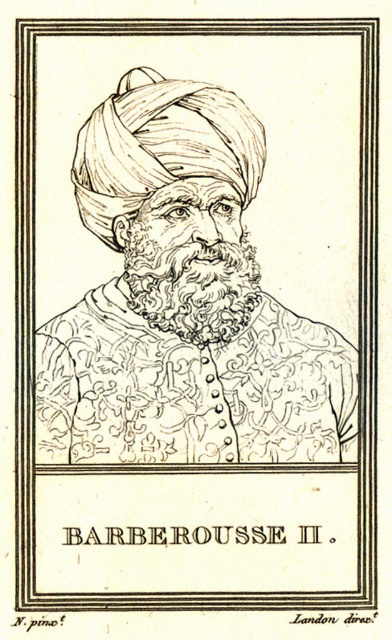
Can you confirm if black ink drawing of man at center is wider than curly brown hair at center?

Yes, black ink drawing of man at center is wider than curly brown hair at center.

Is black ink drawing of man at center shorter than curly brown hair at center?

No.

Where is `black ink drawing of man at center`? The width and height of the screenshot is (392, 640). black ink drawing of man at center is located at coordinates (183, 301).

Locate an element on the screen. Image resolution: width=392 pixels, height=640 pixels. black ink drawing of man at center is located at coordinates (183, 301).

Between black ink drawing of man at center and white textured turban at upper center, which one has more height?

black ink drawing of man at center

Is black ink drawing of man at center above white textured turban at upper center?

No, black ink drawing of man at center is not above white textured turban at upper center.

Which is behind, point (250, 362) or point (181, 93)?

Positioned behind is point (250, 362).

What are the coordinates of `black ink drawing of man at center` in the screenshot? It's located at (183, 301).

Which is below, etched gold robe at center or curly brown hair at center?

Positioned lower is etched gold robe at center.

Which is in front, point (217, 452) or point (241, 294)?

Positioned in front is point (217, 452).

You are a GUI agent. You are given a task and a screenshot of the screen. Output one action in this format:
    pyautogui.click(x=<x>, y=<y>)
    Task: Click on the etched gold robe at center
    This screenshot has width=392, height=640.
    Given the screenshot: What is the action you would take?
    pyautogui.click(x=190, y=388)